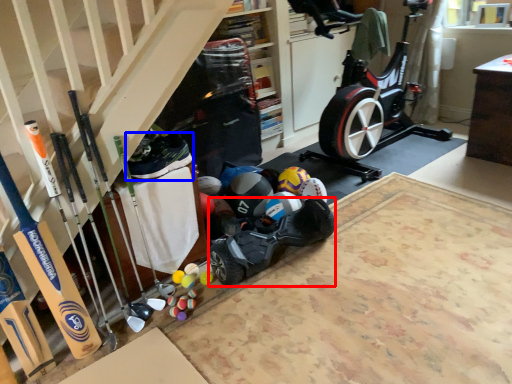
Question: Which object is closer to the camera taking this photo, car (highlighted by a red box) or shoe (highlighted by a blue box)?

Choices:
 (A) car
 (B) shoe

Answer: (B)